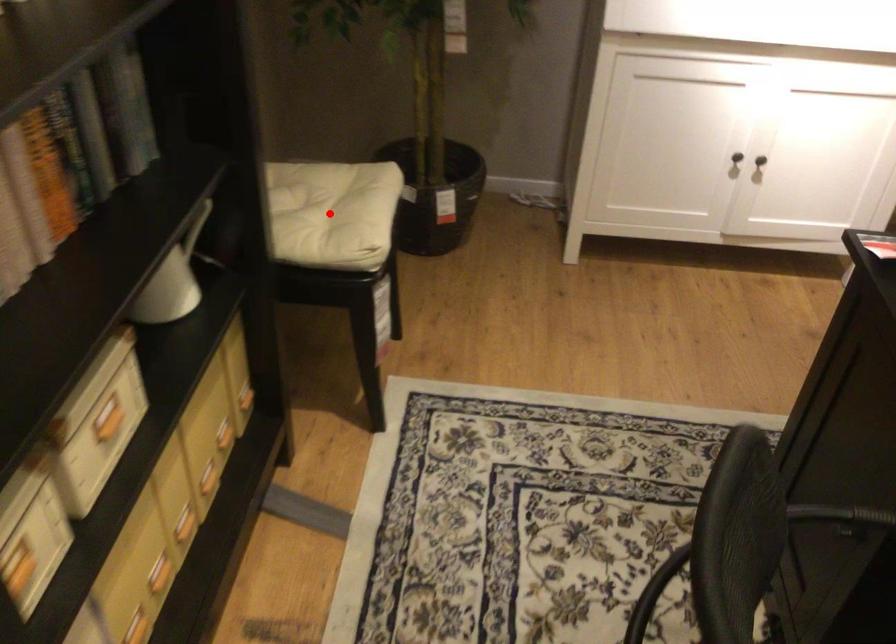
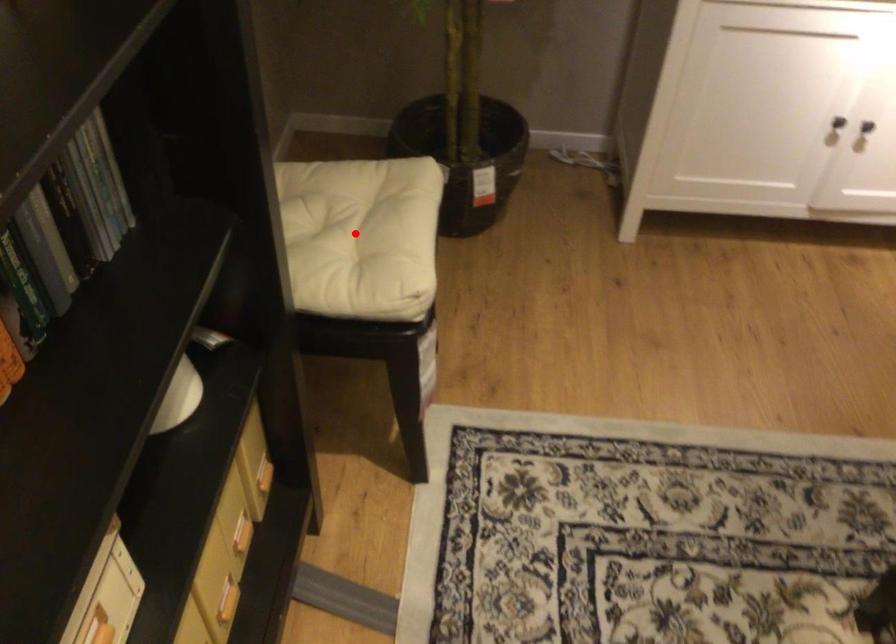
I am providing you with two images of the same scene from different viewpoints. A red point is marked on the first image and another point is marked on the second image. Is the marked point in image1 the same physical position as the marked point in image2?

Yes